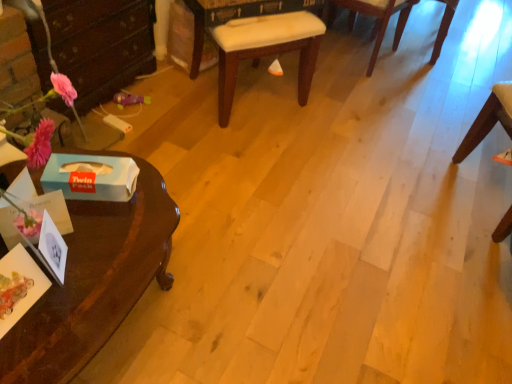
Question: Is blue paper tissue box at left, positioned as the 1th box in front-to-back order, at the back of wooden chair at right, arranged as the second chair when viewed from the left?

Choices:
 (A) yes
 (B) no

Answer: (B)

Question: Is wooden chair at right, acting as the second chair starting from the right, closer to the viewer compared to blue paper tissue box at left, the second box in the back-to-front sequence?

Choices:
 (A) no
 (B) yes

Answer: (A)

Question: Does wooden chair at right, acting as the second chair starting from the right, have a larger size compared to blue paper tissue box at left, positioned as the 1th box in front-to-back order?

Choices:
 (A) no
 (B) yes

Answer: (B)

Question: Could you tell me if wooden chair at right, arranged as the second chair when viewed from the left, is turned towards blue paper tissue box at left, positioned as the 1th box in front-to-back order?

Choices:
 (A) yes
 (B) no

Answer: (A)

Question: Is wooden chair at right, acting as the second chair starting from the right, far away from blue paper tissue box at left, positioned as the 1th box in front-to-back order?

Choices:
 (A) no
 (B) yes

Answer: (B)

Question: In the image, is glossy dark wood desk at left positioned in front of or behind wooden chair at right, arranged as the second chair when viewed from the left?

Choices:
 (A) behind
 (B) front

Answer: (B)

Question: From a real-world perspective, is glossy dark wood desk at left positioned above or below wooden chair at right, acting as the second chair starting from the right?

Choices:
 (A) below
 (B) above

Answer: (A)

Question: From the image's perspective, is glossy dark wood desk at left located above or below wooden chair at right, acting as the second chair starting from the right?

Choices:
 (A) above
 (B) below

Answer: (B)

Question: Is glossy dark wood desk at left wider or thinner than wooden chair at right, acting as the second chair starting from the right?

Choices:
 (A) thin
 (B) wide

Answer: (B)

Question: Looking at their shapes, would you say white cardboard box at lower left, which ranks as the 1th box in back-to-front order, is wider or thinner than glossy dark wood desk at left?

Choices:
 (A) thin
 (B) wide

Answer: (A)

Question: Considering the positions of white cardboard box at lower left, which ranks as the 1th box in back-to-front order, and glossy dark wood desk at left in the image, is white cardboard box at lower left, which ranks as the 1th box in back-to-front order, taller or shorter than glossy dark wood desk at left?

Choices:
 (A) short
 (B) tall

Answer: (A)

Question: Is white cardboard box at lower left, which ranks as the 1th box in back-to-front order, bigger or smaller than glossy dark wood desk at left?

Choices:
 (A) small
 (B) big

Answer: (A)

Question: From the image's perspective, is white cardboard box at lower left, the 2th box when ordered from front to back, located above or below glossy dark wood desk at left?

Choices:
 (A) above
 (B) below

Answer: (A)

Question: Is white fabric cushion at center, which ranks as the 3th chair in right-to-left order, inside the boundaries of glossy dark wood desk at left, or outside?

Choices:
 (A) inside
 (B) outside

Answer: (B)

Question: In terms of height, does white fabric cushion at center, positioned as the first chair in left-to-right order, look taller or shorter compared to glossy dark wood desk at left?

Choices:
 (A) tall
 (B) short

Answer: (A)